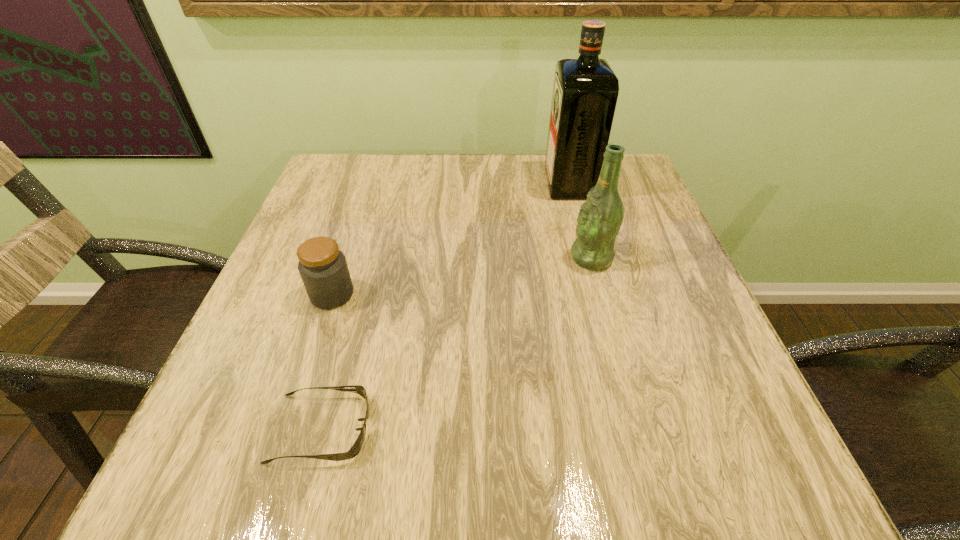
Locate an element on the screen. Image resolution: width=960 pixels, height=540 pixels. liquor present at the right edge is located at coordinates (585, 91).

You are a GUI agent. You are given a task and a screenshot of the screen. Output one action in this format:
    pyautogui.click(x=<x>, y=<y>)
    Task: Click on the beer bottle situated at the right edge
    
    Given the screenshot: What is the action you would take?
    [x=599, y=220]

Where is `object at the near left corner`? object at the near left corner is located at coordinates (355, 449).

Where is `object at the far right corner`? The image size is (960, 540). object at the far right corner is located at coordinates (585, 91).

I want to click on vacant region at the far edge of the desktop, so click(522, 188).

Identify the location of vacant space at the near edge of the desktop. (298, 471).

In the image, there is a desktop. What are the coordinates of `free space at the left edge` in the screenshot? It's located at (344, 207).

Image resolution: width=960 pixels, height=540 pixels. Identify the location of vacant space at the far left corner. (351, 154).

This screenshot has width=960, height=540. I want to click on free point at the near right corner, so click(667, 442).

You are a GUI agent. You are given a task and a screenshot of the screen. Output one action in this format:
    pyautogui.click(x=<x>, y=<y>)
    Task: Click on the empty space between the sunglasses and the third shortest object
    The image size is (960, 540).
    Given the screenshot: What is the action you would take?
    pyautogui.click(x=456, y=343)